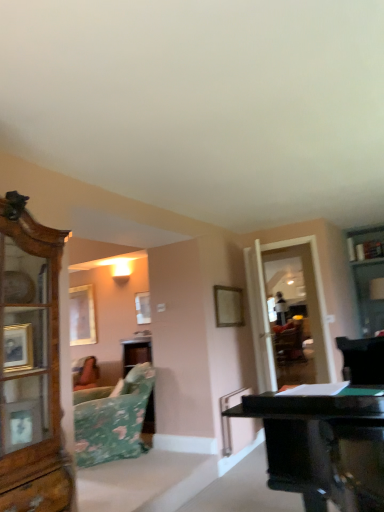
Question: Should I look upward or downward to see wooden picture frame at upper left, arranged as the 2th picture frame when viewed from the right?

Choices:
 (A) down
 (B) up

Answer: (A)

Question: From a real-world perspective, is transparent glass door at right beneath wooden picture frame at upper left, arranged as the 2th picture frame when viewed from the right?

Choices:
 (A) no
 (B) yes

Answer: (B)

Question: Is transparent glass door at right looking in the opposite direction of wooden picture frame at upper left, arranged as the 2th picture frame when viewed from the right?

Choices:
 (A) yes
 (B) no

Answer: (B)

Question: Considering the relative sizes of transparent glass door at right and wooden picture frame at upper left, arranged as the 2th picture frame when viewed from the right, in the image provided, is transparent glass door at right smaller than wooden picture frame at upper left, arranged as the 2th picture frame when viewed from the right,?

Choices:
 (A) yes
 (B) no

Answer: (B)

Question: Is the position of transparent glass door at right less distant than that of wooden picture frame at upper left, arranged as the 2th picture frame when viewed from the right?

Choices:
 (A) no
 (B) yes

Answer: (B)

Question: Does transparent glass door at right have a lesser height compared to wooden picture frame at upper left, the 2th picture frame positioned from the front?

Choices:
 (A) no
 (B) yes

Answer: (A)

Question: From a real-world perspective, is transparent glass door at right positioned over wooden picture frame at upper left, the 2th picture frame positioned from the front, based on gravity?

Choices:
 (A) no
 (B) yes

Answer: (A)

Question: From the image's perspective, would you say floral fabric couch at lower left is positioned over transparent glass door at right?

Choices:
 (A) yes
 (B) no

Answer: (B)

Question: From a real-world perspective, does floral fabric couch at lower left sit lower than transparent glass door at right?

Choices:
 (A) yes
 (B) no

Answer: (A)

Question: Is transparent glass door at right at the back of floral fabric couch at lower left?

Choices:
 (A) no
 (B) yes

Answer: (B)

Question: Does floral fabric couch at lower left appear on the right side of transparent glass door at right?

Choices:
 (A) yes
 (B) no

Answer: (B)

Question: Considering the relative sizes of floral fabric couch at lower left and transparent glass door at right in the image provided, is floral fabric couch at lower left smaller than transparent glass door at right?

Choices:
 (A) yes
 (B) no

Answer: (B)

Question: Does floral fabric couch at lower left have a larger size compared to transparent glass door at right?

Choices:
 (A) yes
 (B) no

Answer: (A)

Question: From a real-world perspective, does wooden picture frame at upper left, which is the first picture frame from left to right, sit lower than floral fabric couch at lower left?

Choices:
 (A) yes
 (B) no

Answer: (B)